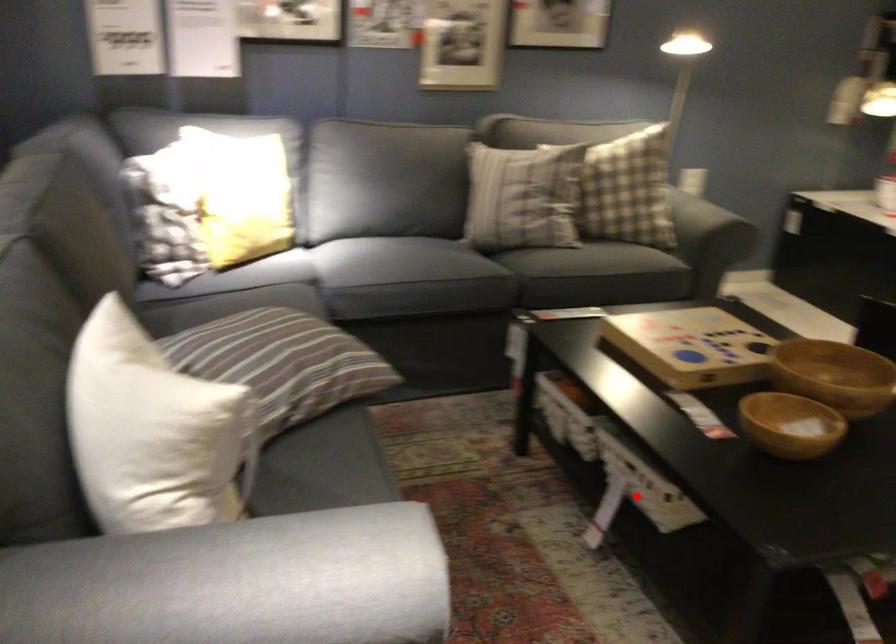
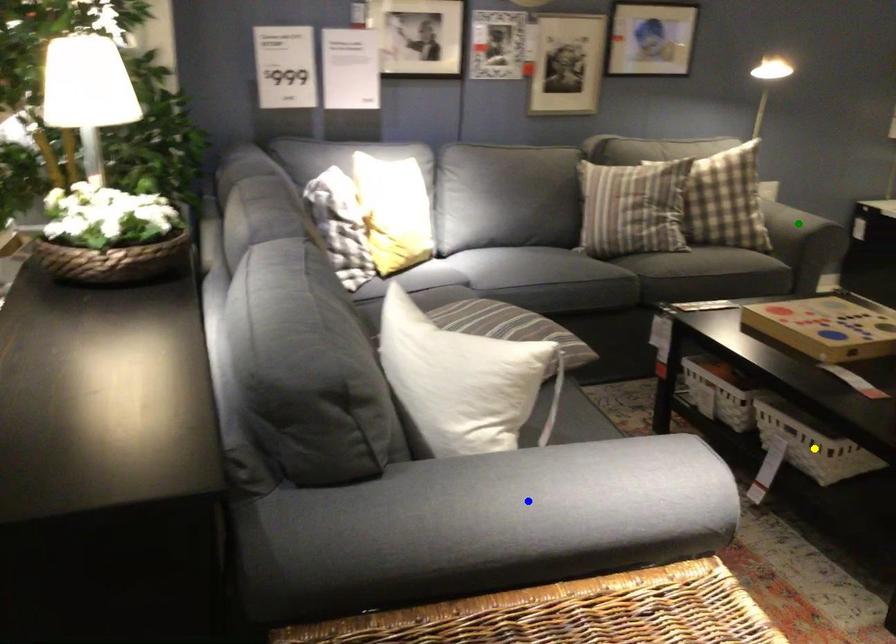
Question: I am providing you with two images of the same scene from different viewpoints. A red point is marked on the first image. You are given multiple points on the second image. Can you choose the point in image 2 that corresponds to the point in image 1?

Choices:
 (A) blue point
 (B) green point
 (C) yellow point

Answer: (C)